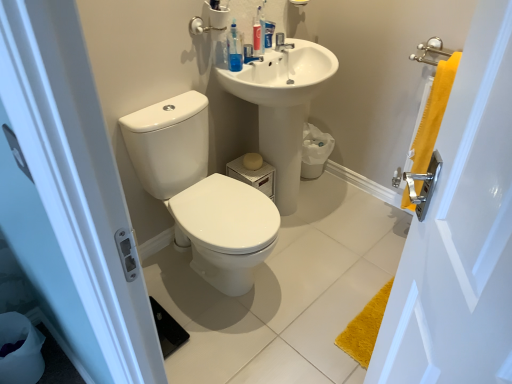
This screenshot has height=384, width=512. Find the location of `white glossy sink at upper center`. white glossy sink at upper center is located at coordinates (283, 107).

What do you see at coordinates (283, 107) in the screenshot? I see `white glossy sink at upper center` at bounding box center [283, 107].

Find the location of `yellow fabric towel at right`. yellow fabric towel at right is located at coordinates (434, 113).

The height and width of the screenshot is (384, 512). Describe the element at coordinates (267, 33) in the screenshot. I see `blue translucent mouthwash at upper center, placed as the 1th mouthwash when sorted from back to front` at that location.

Identify the location of translucent plastic toothpaste tube at upper center. This screenshot has height=384, width=512. [258, 33].

The height and width of the screenshot is (384, 512). Describe the element at coordinates (461, 233) in the screenshot. I see `yellow fabric towel at right` at that location.

The height and width of the screenshot is (384, 512). What do you see at coordinates (200, 192) in the screenshot?
I see `white glossy toilet at center` at bounding box center [200, 192].

You are a GUI agent. You are given a task and a screenshot of the screen. Output one action in this format:
    pyautogui.click(x=<x>, y=<y>)
    Task: Click on the white glossy sink at upper center
    The width and height of the screenshot is (512, 384).
    Given the screenshot: What is the action you would take?
    pyautogui.click(x=283, y=107)

Considering the relative sizes of blue translucent mouthwash at upper center, which ranks as the 1th mouthwash in right-to-left order, and translucent plastic mouthwash at upper center, which is the 2th mouthwash in back-to-front order, in the image provided, is blue translucent mouthwash at upper center, which ranks as the 1th mouthwash in right-to-left order, bigger than translucent plastic mouthwash at upper center, which is the 2th mouthwash in back-to-front order,?

No, blue translucent mouthwash at upper center, which ranks as the 1th mouthwash in right-to-left order, is not bigger than translucent plastic mouthwash at upper center, which is the 2th mouthwash in back-to-front order.

Is blue translucent mouthwash at upper center, placed as the 1th mouthwash when sorted from back to front, taller or shorter than translucent plastic mouthwash at upper center, marked as the 2th mouthwash in a right-to-left arrangement?

Considering their sizes, blue translucent mouthwash at upper center, placed as the 1th mouthwash when sorted from back to front, has less height than translucent plastic mouthwash at upper center, marked as the 2th mouthwash in a right-to-left arrangement.

Which is more to the right, blue translucent mouthwash at upper center, placed as the 1th mouthwash when sorted from back to front, or translucent plastic mouthwash at upper center, marked as the first mouthwash in a front-to-back arrangement?

Positioned to the right is blue translucent mouthwash at upper center, placed as the 1th mouthwash when sorted from back to front.

Is white glossy sink at upper center wider than yellow fabric towel at right?

Indeed, white glossy sink at upper center has a greater width compared to yellow fabric towel at right.

Would you say white glossy sink at upper center is a long distance from yellow fabric towel at right?

Yes, white glossy sink at upper center is far from yellow fabric towel at right.

From a real-world perspective, relative to yellow fabric towel at right, is white glossy sink at upper center vertically above or below?

Clearly, from a real-world perspective, white glossy sink at upper center is below yellow fabric towel at right.

How different are the orientations of white glossy sink at upper center and yellow fabric towel at right in degrees?

138 degrees separate the facing orientations of white glossy sink at upper center and yellow fabric towel at right.

Is satin nickel faucet at upper center located outside translucent plastic toothpaste tube at upper center?

Yes, satin nickel faucet at upper center is located beyond the bounds of translucent plastic toothpaste tube at upper center.

Is point (287, 48) closer to camera compared to point (262, 34)?

No, it is behind (262, 34).

From the picture: Considering the sizes of satin nickel faucet at upper center and translucent plastic toothpaste tube at upper center in the image, is satin nickel faucet at upper center taller or shorter than translucent plastic toothpaste tube at upper center?

In the image, satin nickel faucet at upper center appears to be shorter than translucent plastic toothpaste tube at upper center.

Can you tell me how much white glossy sink at upper center and yellow fabric towel at right differ in facing direction?

The angle between the facing direction of white glossy sink at upper center and the facing direction of yellow fabric towel at right is 89.5 degrees.

Is white glossy sink at upper center positioned with its back to yellow fabric towel at right?

No, yellow fabric towel at right is not at the back of white glossy sink at upper center.

Would you say white glossy sink at upper center is a long distance from yellow fabric towel at right?

No, white glossy sink at upper center is in close proximity to yellow fabric towel at right.

From the image's perspective, which one is positioned lower, translucent plastic toothpaste tube at upper center or yellow fabric towel at right?

From the image's view, yellow fabric towel at right is below.

Does translucent plastic toothpaste tube at upper center have a lesser height compared to yellow fabric towel at right?

Correct, translucent plastic toothpaste tube at upper center is not as tall as yellow fabric towel at right.

Can you see translucent plastic toothpaste tube at upper center touching yellow fabric towel at right?

No, translucent plastic toothpaste tube at upper center is not in contact with yellow fabric towel at right.

Relative to yellow fabric towel at right, is translucent plastic toothpaste tube at upper center in front or behind?

Clearly, translucent plastic toothpaste tube at upper center is behind yellow fabric towel at right.

Considering the relative sizes of yellow fabric towel at right and translucent plastic mouthwash at upper center, marked as the 2th mouthwash in a right-to-left arrangement, in the image provided, is yellow fabric towel at right shorter than translucent plastic mouthwash at upper center, marked as the 2th mouthwash in a right-to-left arrangement,?

No, yellow fabric towel at right is not shorter than translucent plastic mouthwash at upper center, marked as the 2th mouthwash in a right-to-left arrangement.

This screenshot has width=512, height=384. What are the coordinates of `bath towel that is on the right side of translucent plastic mouthwash at upper center, which is the 2th mouthwash in back-to-front order` in the screenshot? It's located at [x=434, y=113].

What's the angular difference between yellow fabric towel at right and translucent plastic mouthwash at upper center, marked as the first mouthwash in a front-to-back arrangement,'s facing directions?

yellow fabric towel at right and translucent plastic mouthwash at upper center, marked as the first mouthwash in a front-to-back arrangement, are facing 97 degrees away from each other.

Is yellow fabric towel at right to the left or to the right of translucent plastic mouthwash at upper center, marked as the 2th mouthwash in a right-to-left arrangement, in the image?

In the image, yellow fabric towel at right appears on the right side of translucent plastic mouthwash at upper center, marked as the 2th mouthwash in a right-to-left arrangement.

Are translucent plastic mouthwash at upper center, which is the 2th mouthwash in back-to-front order, and white glossy sink at upper center far apart?

translucent plastic mouthwash at upper center, which is the 2th mouthwash in back-to-front order, is near white glossy sink at upper center, not far away.

Do you think translucent plastic mouthwash at upper center, marked as the 2th mouthwash in a right-to-left arrangement, is within white glossy sink at upper center, or outside of it?

translucent plastic mouthwash at upper center, marked as the 2th mouthwash in a right-to-left arrangement, lies outside white glossy sink at upper center.

Is point (231, 53) farther from camera compared to point (318, 69)?

No, (231, 53) is in front of (318, 69).

From a real-world perspective, is translucent plastic mouthwash at upper center, marked as the first mouthwash in a front-to-back arrangement, above or below white glossy sink at upper center?

translucent plastic mouthwash at upper center, marked as the first mouthwash in a front-to-back arrangement, is situated higher than white glossy sink at upper center in the real world.

At what (x,y) coordinates should I click in order to perform the action: click on mouthwash lying in front of the blue translucent mouthwash at upper center, arranged as the 2th mouthwash when viewed from the left. Please return your answer as a coordinate pair (x, y). The image size is (512, 384). Looking at the image, I should click on (234, 49).

Where is `screen door that appears on the right of white glossy sink at upper center`? screen door that appears on the right of white glossy sink at upper center is located at coordinates (461, 233).

Estimate the real-world distances between objects in this image. Which object is closer to white glossy toilet at center, blue translucent mouthwash at upper center, arranged as the 2th mouthwash when viewed from the left, or translucent plastic mouthwash at upper center, marked as the first mouthwash in a front-to-back arrangement?

translucent plastic mouthwash at upper center, marked as the first mouthwash in a front-to-back arrangement, is closer to white glossy toilet at center.

Considering their positions, is yellow fabric towel at right positioned closer to white glossy toilet at center than satin nickel faucet at upper center?

The object closer to white glossy toilet at center is satin nickel faucet at upper center.

Considering their positions, is satin nickel faucet at upper center positioned further to white glossy sink at upper center than translucent plastic toothpaste tube at upper center?

satin nickel faucet at upper center.

When comparing their distances from satin nickel faucet at upper center, does blue translucent mouthwash at upper center, placed as the 1th mouthwash when sorted from back to front, or translucent plastic mouthwash at upper center, which ranks as the 1th mouthwash in left-to-right order, seem further?

Among the two, translucent plastic mouthwash at upper center, which ranks as the 1th mouthwash in left-to-right order, is located further to satin nickel faucet at upper center.

Estimate the real-world distances between objects in this image. Which object is further from yellow fabric towel at right, translucent plastic toothpaste tube at upper center or white glossy sink at upper center?

translucent plastic toothpaste tube at upper center lies further to yellow fabric towel at right than the other object.

From the image, which object appears to be farther from blue translucent mouthwash at upper center, arranged as the 2th mouthwash when viewed from the left, translucent plastic mouthwash at upper center, marked as the 2th mouthwash in a right-to-left arrangement, or satin nickel faucet at upper center?

The object further to blue translucent mouthwash at upper center, arranged as the 2th mouthwash when viewed from the left, is translucent plastic mouthwash at upper center, marked as the 2th mouthwash in a right-to-left arrangement.

Based on their spatial positions, is translucent plastic mouthwash at upper center, which ranks as the 1th mouthwash in left-to-right order, or white glossy toilet at center further from satin nickel faucet at upper center?

Among the two, white glossy toilet at center is located further to satin nickel faucet at upper center.

Looking at the image, which one is located further to satin nickel faucet at upper center, yellow fabric towel at right or white glossy sink at upper center?

Among the two, yellow fabric towel at right is located further to satin nickel faucet at upper center.

Locate an element on the screen. sink between white glossy toilet at center and yellow fabric towel at right in the horizontal direction is located at coordinates (283, 107).

The image size is (512, 384). What are the coordinates of `toiletry situated between white glossy toilet at center and yellow fabric towel at right from left to right` in the screenshot? It's located at (258, 33).

Locate an element on the screen. This screenshot has height=384, width=512. bath towel between yellow fabric towel at right and translucent plastic toothpaste tube at upper center along the z-axis is located at coordinates (434, 113).

You are a GUI agent. You are given a task and a screenshot of the screen. Output one action in this format:
    pyautogui.click(x=<x>, y=<y>)
    Task: Click on the tap between translucent plastic mouthwash at upper center, which ranks as the 1th mouthwash in left-to-right order, and yellow fabric towel at right from left to right
    The height and width of the screenshot is (384, 512).
    Given the screenshot: What is the action you would take?
    pyautogui.click(x=282, y=43)